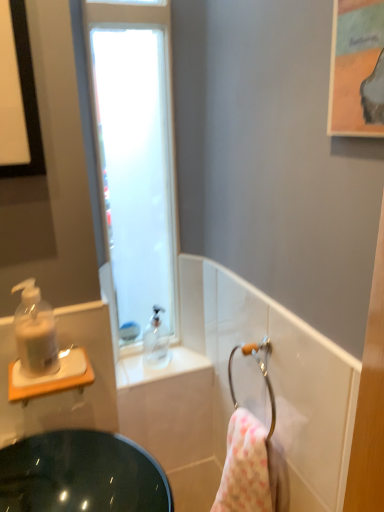
Question: Is frosted glass window at upper left oriented away from white textured towel at lower right?

Choices:
 (A) yes
 (B) no

Answer: (B)

Question: Is frosted glass window at upper left bigger than white textured towel at lower right?

Choices:
 (A) yes
 (B) no

Answer: (A)

Question: Is the position of frosted glass window at upper left more distant than that of white textured towel at lower right?

Choices:
 (A) no
 (B) yes

Answer: (B)

Question: Is frosted glass window at upper left to the left of white textured towel at lower right from the viewer's perspective?

Choices:
 (A) no
 (B) yes

Answer: (B)

Question: From the image's perspective, is frosted glass window at upper left over white textured towel at lower right?

Choices:
 (A) no
 (B) yes

Answer: (B)

Question: Is the depth of frosted glass window at upper left less than that of white textured towel at lower right?

Choices:
 (A) yes
 (B) no

Answer: (B)

Question: Can you confirm if white textured towel at lower right is thinner than frosted glass window at upper left?

Choices:
 (A) yes
 (B) no

Answer: (B)

Question: Is frosted glass window at upper left surrounded by white textured towel at lower right?

Choices:
 (A) yes
 (B) no

Answer: (B)

Question: From a real-world perspective, is white textured towel at lower right located beneath frosted glass window at upper left?

Choices:
 (A) yes
 (B) no

Answer: (A)

Question: Considering the relative sizes of white textured towel at lower right and frosted glass window at upper left in the image provided, is white textured towel at lower right bigger than frosted glass window at upper left?

Choices:
 (A) yes
 (B) no

Answer: (B)

Question: Is white textured towel at lower right at the right side of frosted glass window at upper left?

Choices:
 (A) yes
 (B) no

Answer: (A)

Question: From the image's perspective, is white textured towel at lower right above frosted glass window at upper left?

Choices:
 (A) no
 (B) yes

Answer: (A)

Question: Is frosted glass window at upper left in contact with translucent plastic sink at left?

Choices:
 (A) yes
 (B) no

Answer: (B)